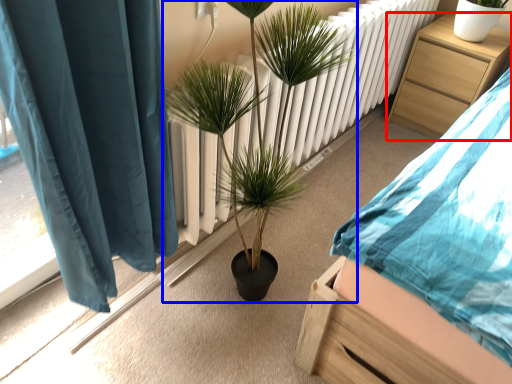
Question: Which object is closer to the camera taking this photo, nightstand (highlighted by a red box) or houseplant (highlighted by a blue box)?

Choices:
 (A) nightstand
 (B) houseplant

Answer: (B)